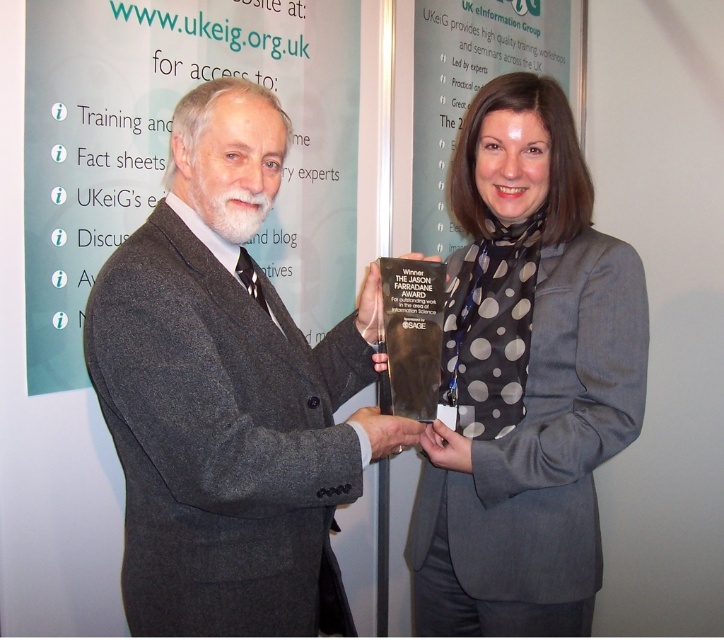
Is dark gray suit at center taller than polka dot scarf at center?

In fact, dark gray suit at center may be shorter than polka dot scarf at center.

Does dark gray suit at center come in front of polka dot scarf at center?

That is True.

Who is more forward, (260,372) or (576,273)?

Positioned in front is point (260,372).

Find the location of a particular element. dark gray suit at center is located at coordinates (227, 396).